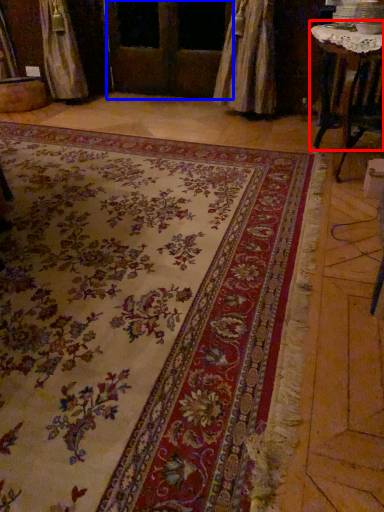
Question: Which object appears farthest to the camera in this image, table (highlighted by a red box) or screen door (highlighted by a blue box)?

Choices:
 (A) table
 (B) screen door

Answer: (B)